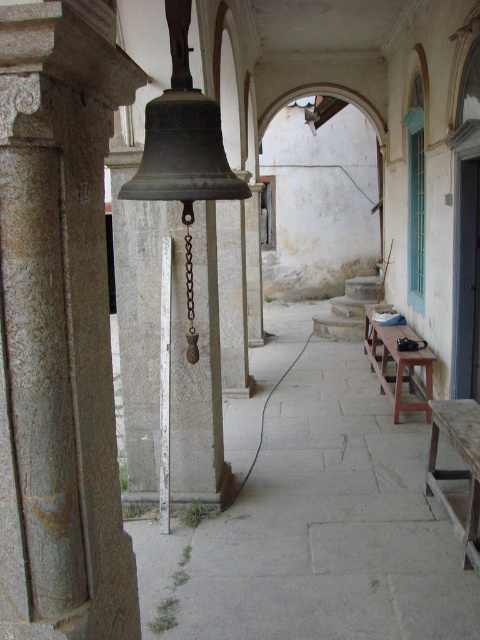
Question: Does gray stone pillar at center have a smaller size compared to wooden picnic table at center?

Choices:
 (A) yes
 (B) no

Answer: (A)

Question: Estimate the real-world distances between objects in this image. Which object is farther from the gray stone pillar at center?

Choices:
 (A) smooth stone alley at center
 (B) wooden picnic table at center

Answer: (B)

Question: Estimate the real-world distances between objects in this image. Which object is closer to the gray stone pillar at center?

Choices:
 (A) smooth stone alley at center
 (B) wooden picnic table at center

Answer: (A)

Question: Where is gray stone pillar at center located in relation to wooden picnic table at center in the image?

Choices:
 (A) right
 (B) left

Answer: (B)

Question: Is gray stone pillar at center thinner than wooden picnic table at center?

Choices:
 (A) no
 (B) yes

Answer: (B)

Question: Estimate the real-world distances between objects in this image. Which object is closer to the wooden picnic table at center?

Choices:
 (A) gray stone pillar at center
 (B) smooth stone alley at center

Answer: (B)